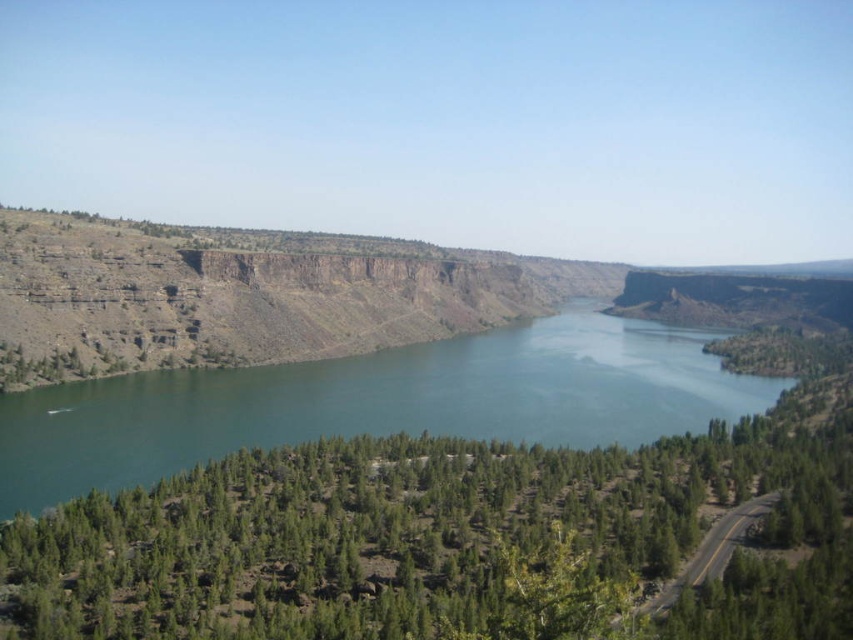
Between green leafy trees at center and green water at center, which one has less height?

green leafy trees at center is shorter.

Locate an element on the screen. The width and height of the screenshot is (853, 640). green leafy trees at center is located at coordinates (456, 540).

Locate an element on the screen. green leafy trees at center is located at coordinates (456, 540).